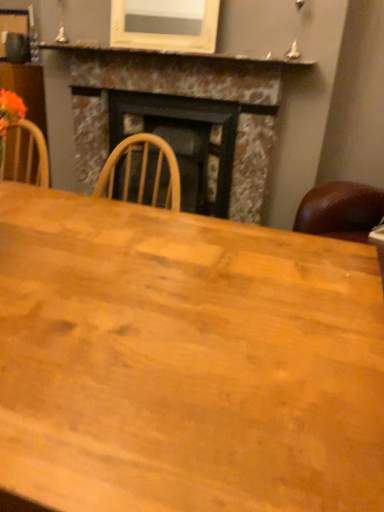
Question: Considering the relative sizes of wooden table at center and marble fireplace at center in the image provided, is wooden table at center taller than marble fireplace at center?

Choices:
 (A) yes
 (B) no

Answer: (B)

Question: From the image's perspective, is wooden table at center on marble fireplace at center?

Choices:
 (A) yes
 (B) no

Answer: (B)

Question: Is wooden table at center at the right side of marble fireplace at center?

Choices:
 (A) no
 (B) yes

Answer: (B)

Question: Can you see wooden table at center touching marble fireplace at center?

Choices:
 (A) yes
 (B) no

Answer: (B)

Question: Is wooden table at center looking in the opposite direction of marble fireplace at center?

Choices:
 (A) no
 (B) yes

Answer: (A)

Question: Is wooden table at center at the left side of marble fireplace at center?

Choices:
 (A) no
 (B) yes

Answer: (A)

Question: From a real-world perspective, is marble mantel at upper center positioned under marble fireplace at center based on gravity?

Choices:
 (A) yes
 (B) no

Answer: (B)

Question: From the image's perspective, is marble mantel at upper center on top of marble fireplace at center?

Choices:
 (A) no
 (B) yes

Answer: (B)

Question: Are marble mantel at upper center and marble fireplace at center beside each other?

Choices:
 (A) yes
 (B) no

Answer: (B)

Question: Is marble mantel at upper center aimed at marble fireplace at center?

Choices:
 (A) yes
 (B) no

Answer: (B)

Question: Is marble mantel at upper center at the left side of marble fireplace at center?

Choices:
 (A) no
 (B) yes

Answer: (B)

Question: Is marble mantel at upper center closer to camera compared to marble fireplace at center?

Choices:
 (A) no
 (B) yes

Answer: (B)

Question: From a real-world perspective, is marble fireplace at center under wooden table at center?

Choices:
 (A) no
 (B) yes

Answer: (A)